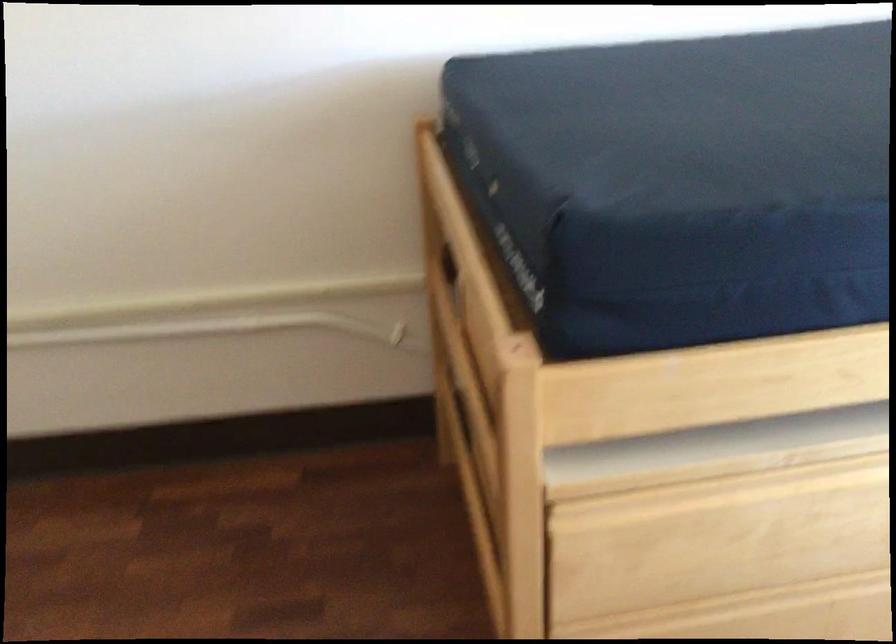
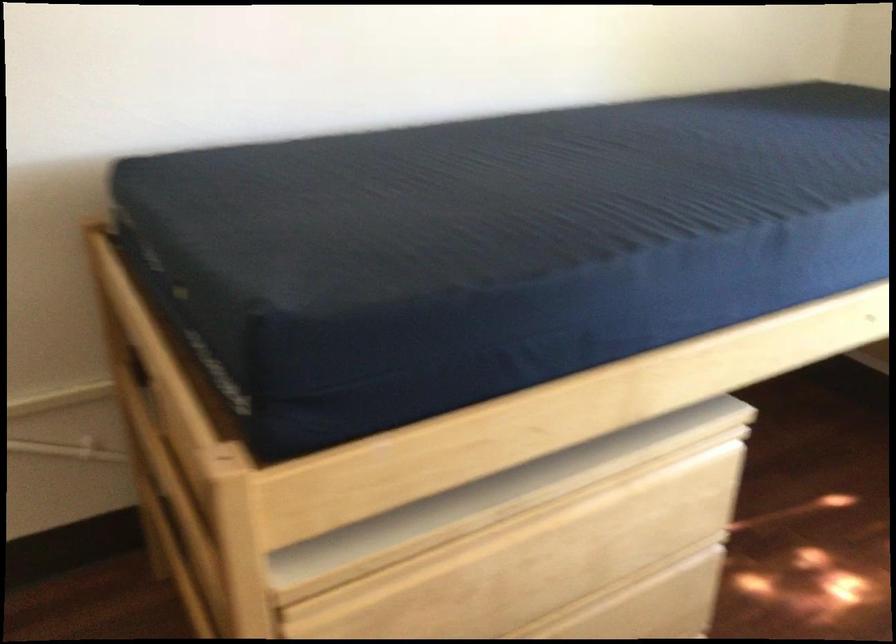
Question: Based on the continuous images, in which direction is the camera rotating? Reply with the corresponding letter.

Choices:
 (A) Left
 (B) Right
 (C) Up
 (D) Down

Answer: (B)